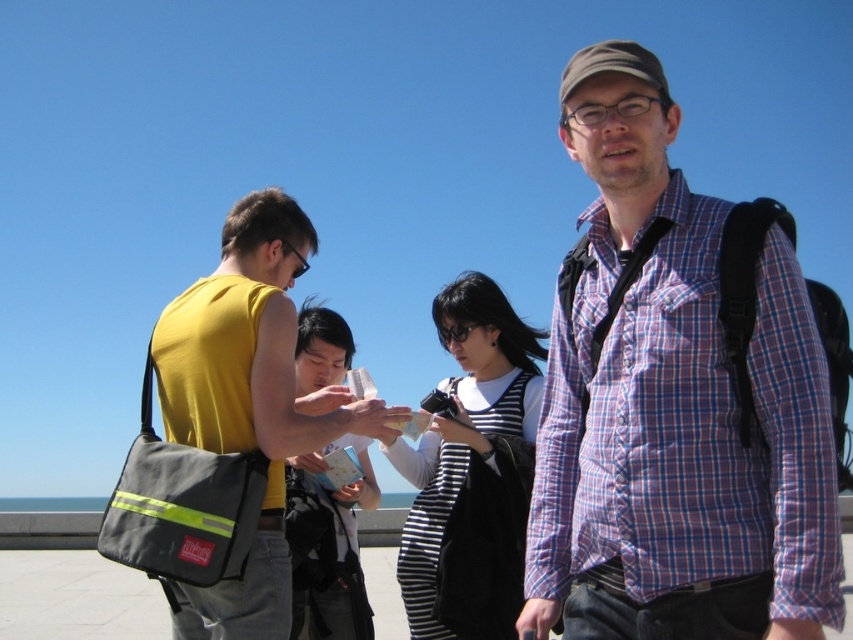
You are a photographer taking a group photo of the plaid cotton shirt at center and the striped fabric shirt at center. Which one should you focus on first if you want to capture both clearly?

The plaid cotton shirt at center is positioned over the striped fabric shirt at center, so focusing on the plaid cotton shirt at center first would ensure both are in focus as the striped fabric shirt at center is behind it.

You are standing at the center of the image and want to hand a map to the person wearing the plaid cotton shirt at center. In which direction should you move to reach them?

The plaid cotton shirt at center is located at point (674, 406), so you should move towards the lower right direction to reach them.